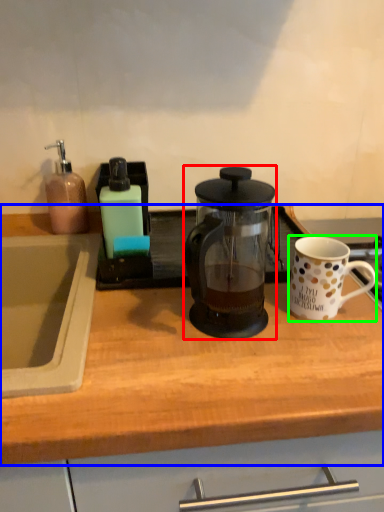
Question: Considering the real-world distances, which object is closest to kettle (highlighted by a red box)? countertop (highlighted by a blue box) or coffee cup (highlighted by a green box).

Choices:
 (A) countertop
 (B) coffee cup

Answer: (B)